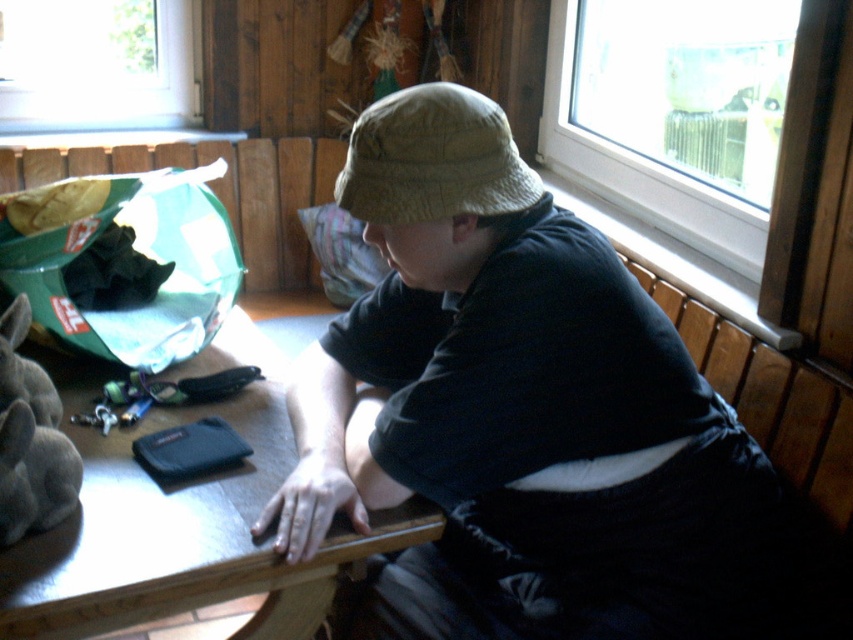
Does point (108, 532) come behind point (570, 65)?

No, it is in front of (570, 65).

Who is more forward, (202, 515) or (735, 104)?

Point (202, 515) is more forward.

In the scene shown: Measure the distance between point (28, 556) and camera.

1.02 meters

Locate an element on the screen. The width and height of the screenshot is (853, 640). wooden table at center is located at coordinates (181, 518).

Based on the photo, is matte khaki bucket hat at center below wooden table at center?

No, matte khaki bucket hat at center is not below wooden table at center.

Between matte khaki bucket hat at center and wooden table at center, which one appears on the left side from the viewer's perspective?

Positioned to the left is wooden table at center.

Where is `matte khaki bucket hat at center`? matte khaki bucket hat at center is located at coordinates (515, 410).

Which is above, matte khaki bucket hat at center or gray plush rabbit at lower left?

Positioned higher is gray plush rabbit at lower left.

Can you confirm if matte khaki bucket hat at center is positioned to the left of gray plush rabbit at lower left?

In fact, matte khaki bucket hat at center is to the right of gray plush rabbit at lower left.

Who is more forward, (486, 522) or (15, 394)?

Point (15, 394) is in front.

Where is `matte khaki bucket hat at center`? The image size is (853, 640). matte khaki bucket hat at center is located at coordinates (515, 410).